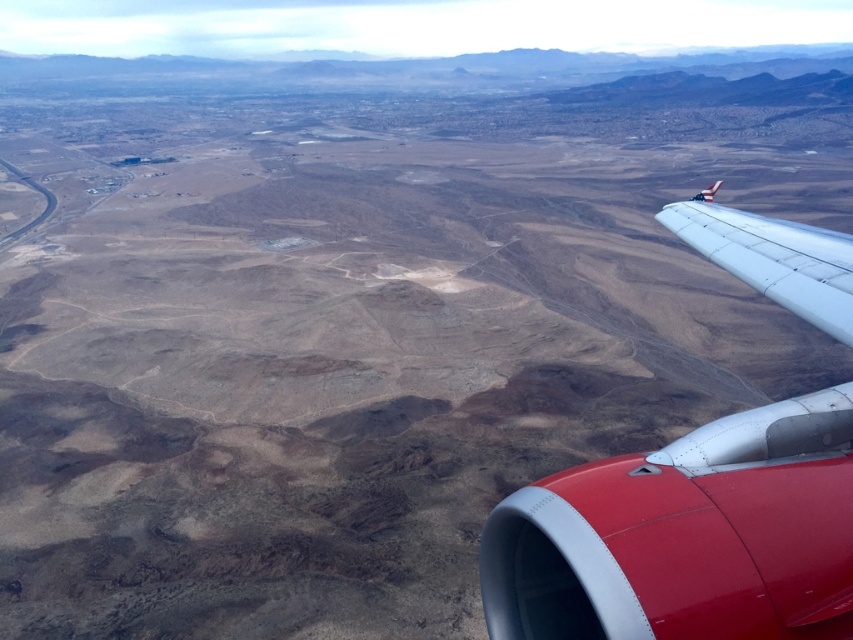
Does metallic silver wing at upper right appear on the left side of white matte wing at right?

Indeed, metallic silver wing at upper right is positioned on the left side of white matte wing at right.

Which is more to the right, metallic silver wing at upper right or white matte wing at right?

Positioned to the right is white matte wing at right.

The width and height of the screenshot is (853, 640). I want to click on metallic silver wing at upper right, so click(686, 536).